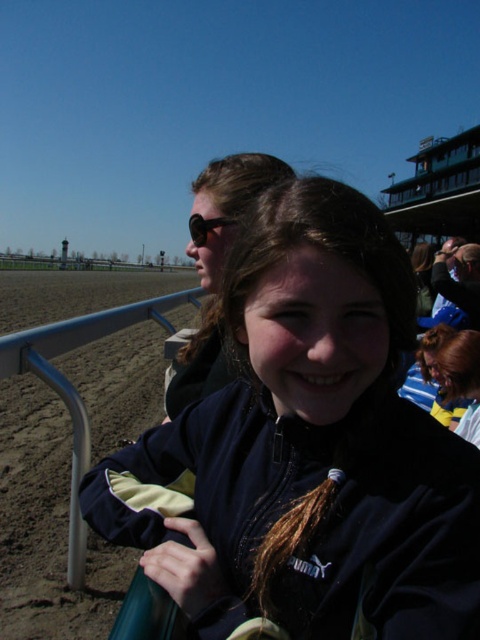
Is matte black jacket at center positioned behind matte black sunglasses at upper center?

No, matte black jacket at center is in front of matte black sunglasses at upper center.

Between matte black jacket at center and matte black sunglasses at upper center, which one is positioned higher?

matte black sunglasses at upper center is higher up.

Is point (177, 390) positioned after point (192, 230)?

Yes, point (177, 390) is behind point (192, 230).

Where is `matte black jacket at center`? Image resolution: width=480 pixels, height=640 pixels. matte black jacket at center is located at coordinates (216, 266).

Does navy blue jacket at center lie in front of matte black jacket at center?

Yes, navy blue jacket at center is in front of matte black jacket at center.

Is navy blue jacket at center above matte black jacket at center?

No.

Between point (360, 500) and point (204, 236), which one is positioned in front?

Point (360, 500) is more forward.

I want to click on navy blue jacket at center, so click(305, 449).

Is navy blue jacket at center positioned before matte black sunglasses at upper center?

Yes, navy blue jacket at center is in front of matte black sunglasses at upper center.

Can you confirm if navy blue jacket at center is positioned above matte black sunglasses at upper center?

Actually, navy blue jacket at center is below matte black sunglasses at upper center.

Which is in front, point (465, 524) or point (195, 216)?

Positioned in front is point (465, 524).

Where is `navy blue jacket at center`? navy blue jacket at center is located at coordinates (305, 449).